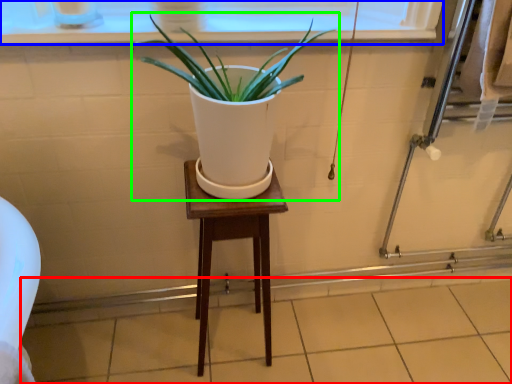
Question: Which is farther away from tile (highlighted by a red box)? window frame (highlighted by a blue box) or houseplant (highlighted by a green box)?

Choices:
 (A) window frame
 (B) houseplant

Answer: (A)